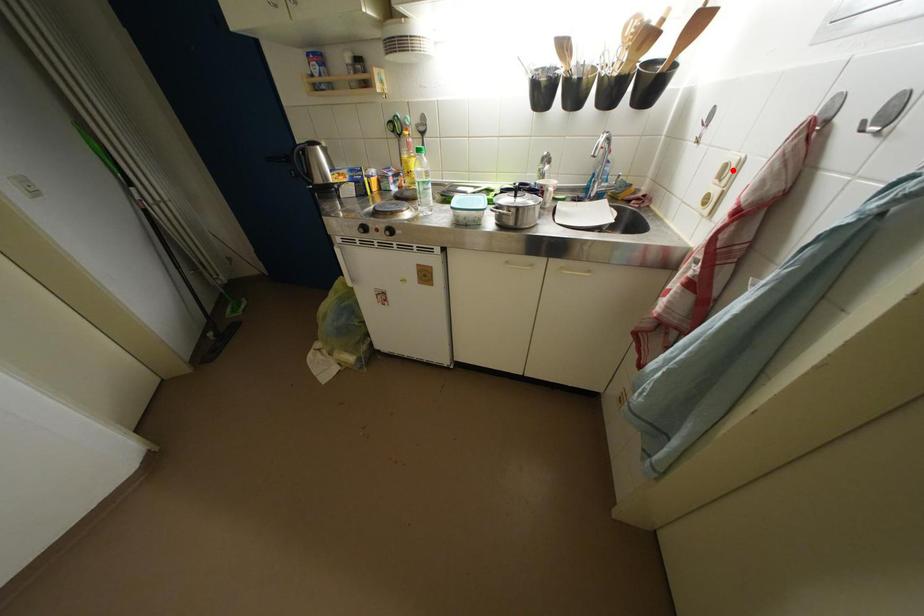
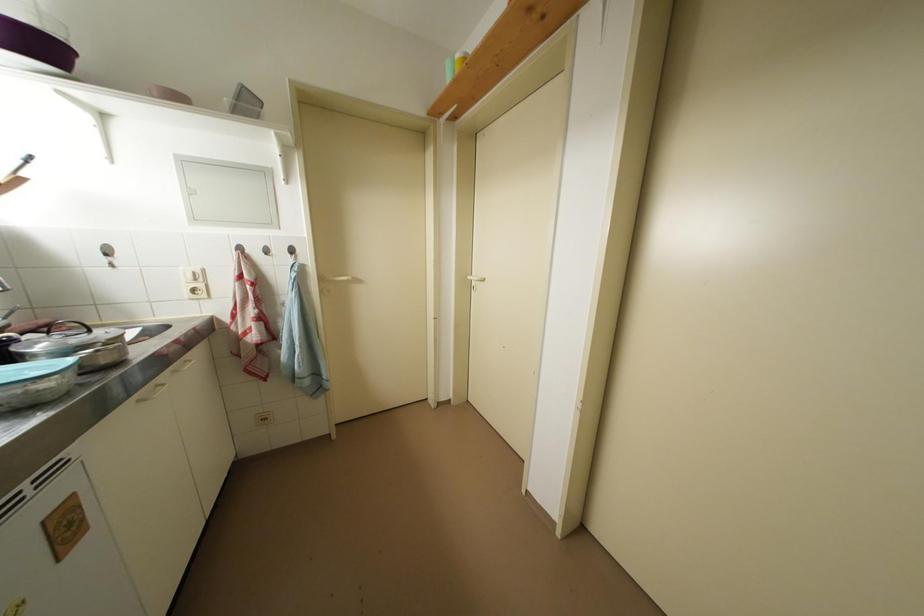
Where in the second image is the point corresponding to the highlighted location from the first image?

(201, 277)